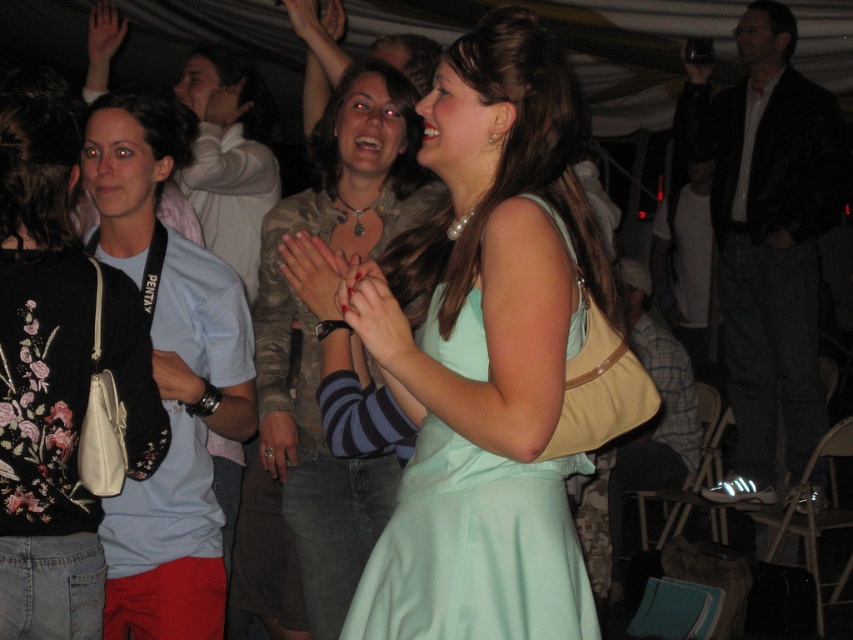
Is matte black purse at left thinner than camouflage fabric jacket at center?

Yes.

Find the location of a particular element. The height and width of the screenshot is (640, 853). matte black purse at left is located at coordinates (56, 380).

Who is higher up, light teal dress at center or matte black purse at left?

Positioned higher is light teal dress at center.

Can you confirm if light teal dress at center is bigger than matte black purse at left?

Correct, light teal dress at center is larger in size than matte black purse at left.

Between point (352, 595) and point (1, 275), which one is positioned in front?

Point (1, 275)

Identify the location of light teal dress at center. (485, 353).

Who is positioned more to the left, light teal dress at center or camouflage fabric jacket at center?

camouflage fabric jacket at center

Who is more distant from viewer, (390, 298) or (316, 618)?

The point (316, 618) is more distant.

The image size is (853, 640). Find the location of `light teal dress at center`. light teal dress at center is located at coordinates (485, 353).